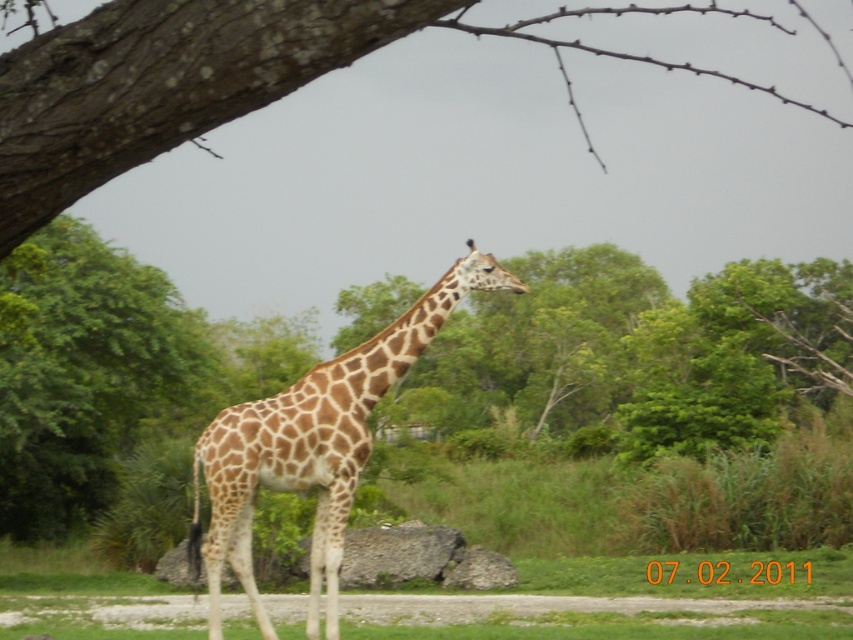
You are a bird flying at the same height as the spotted fur giraffe at center. Can you see the brown rough bark at upper left from your current position?

Yes, because the brown rough bark at upper left is above the spotted fur giraffe at center, so the bird can see it from its position at the giraffe level.

You are standing at the point marked by the coordinates point (51, 205) in the image. You want to take a photo of the giraffe without any obstructions. Is there enough space between you and the giraffe to ensure a clear shot?

The distance between you and the giraffe is 15.41 feet, which should provide sufficient space to take a clear photo without obstructions.

From the picture: You are a bird flying towards the brown rough bark at upper left and the spotted fur giraffe at center. Which object will you reach first?

The brown rough bark at upper left is wider than the spotted fur giraffe at center, so you will reach the brown rough bark at upper left first.